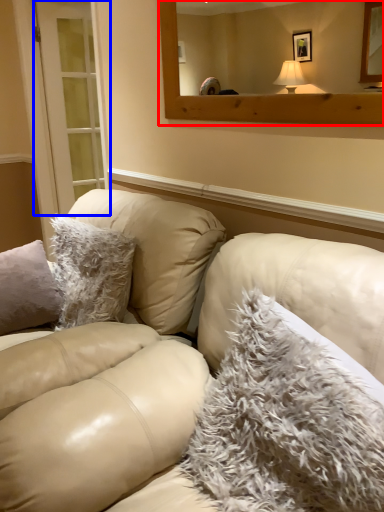
Question: Among these objects, which one is nearest to the camera, mirror (highlighted by a red box) or glass door (highlighted by a blue box)?

Choices:
 (A) mirror
 (B) glass door

Answer: (A)